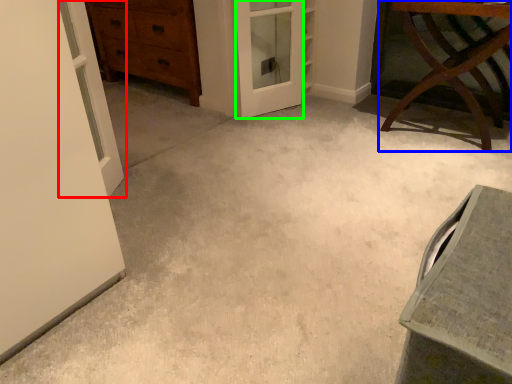
Question: Which object is positioned closest to door (highlighted by a red box)? Select from furniture (highlighted by a blue box) and screen door (highlighted by a green box).

Choices:
 (A) furniture
 (B) screen door

Answer: (B)